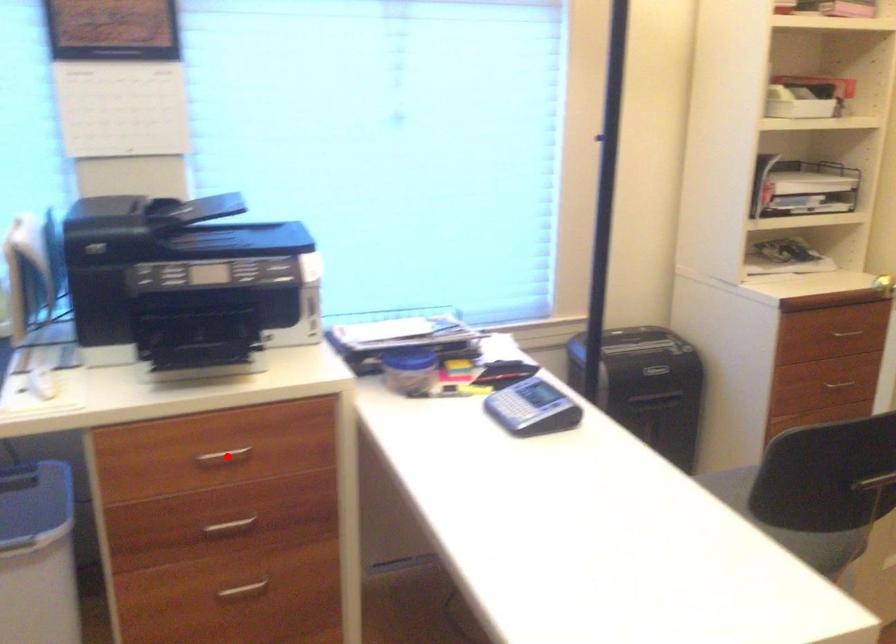
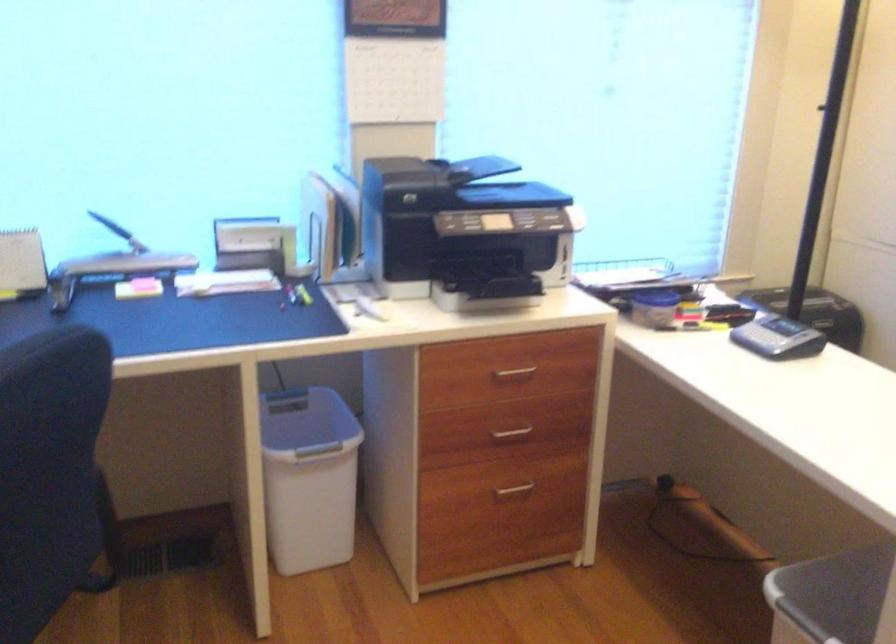
Locate, in the second image, the point that corresponds to the highlighted location in the first image.

(513, 374)